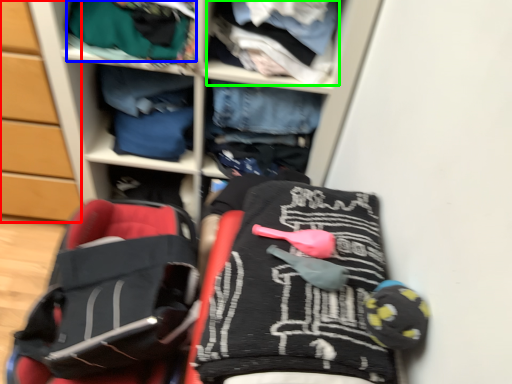
Question: Which is nearer to the cabinetry (highlighted by a red box)? clothing (highlighted by a blue box) or clothing (highlighted by a green box).

Choices:
 (A) clothing
 (B) clothing

Answer: (A)